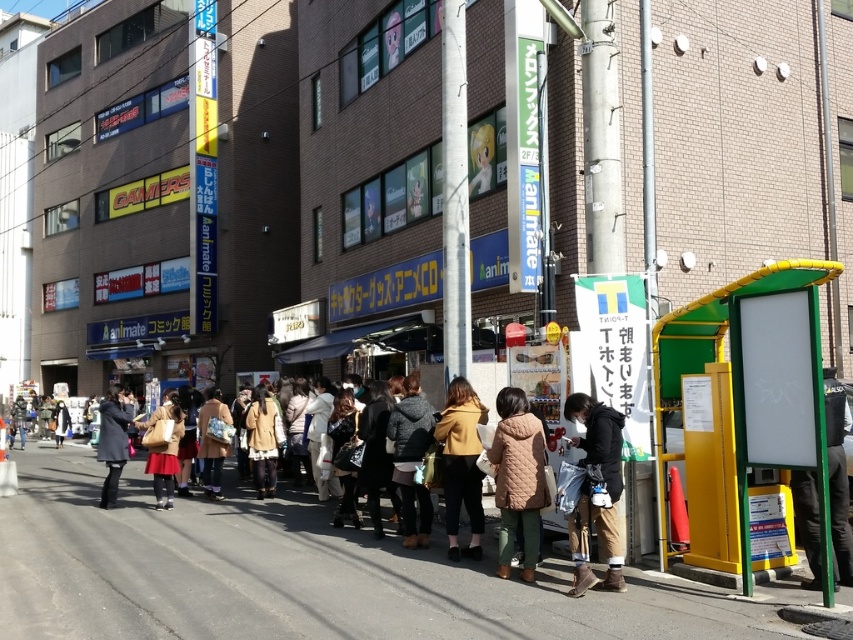
From the picture: Who is positioned more to the left, light brown fabric coat at center or matte gray coat at center?

matte gray coat at center is more to the left.

Is point (260, 484) positioned behind point (102, 458)?

Yes, it is.

The width and height of the screenshot is (853, 640). I want to click on light brown fabric coat at center, so click(263, 440).

Locate an element on the screen. Image resolution: width=853 pixels, height=640 pixels. light brown fabric coat at center is located at coordinates (263, 440).

Who is positioned more to the right, dark gray fleece jacket at center or light brown fabric coat at center?

dark gray fleece jacket at center

Can you confirm if dark gray fleece jacket at center is thinner than light brown fabric coat at center?

Indeed, dark gray fleece jacket at center has a lesser width compared to light brown fabric coat at center.

Who is more forward, (421, 516) or (247, 412)?

Positioned in front is point (421, 516).

Locate an element on the screen. The width and height of the screenshot is (853, 640). dark gray fleece jacket at center is located at coordinates (410, 460).

Which of these two, brown quilted jacket at center or brown quilted coat at center, stands shorter?

→ brown quilted jacket at center is shorter.

The width and height of the screenshot is (853, 640). I want to click on brown quilted jacket at center, so click(518, 477).

Locate an element on the screen. brown quilted jacket at center is located at coordinates (518, 477).